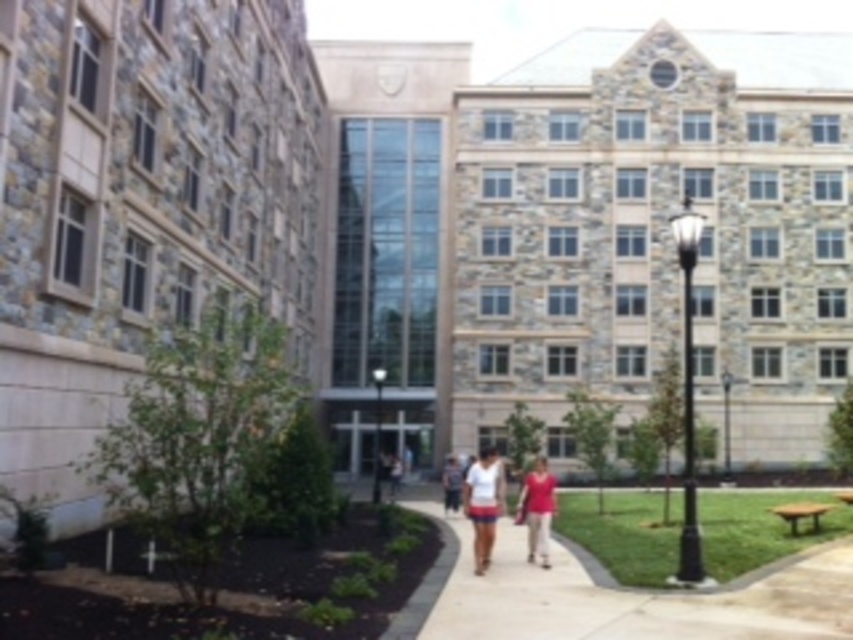
Question: Can you confirm if white cotton shirt at center is positioned to the left of matte pink shirt at center?

Choices:
 (A) no
 (B) yes

Answer: (B)

Question: Is white cotton shirt at center below matte pink shirt at center?

Choices:
 (A) no
 (B) yes

Answer: (A)

Question: Can you confirm if white cotton shirt at center is positioned to the left of matte pink shirt at center?

Choices:
 (A) yes
 (B) no

Answer: (A)

Question: Which point appears farthest from the camera in this image?

Choices:
 (A) (546, 502)
 (B) (491, 451)

Answer: (B)